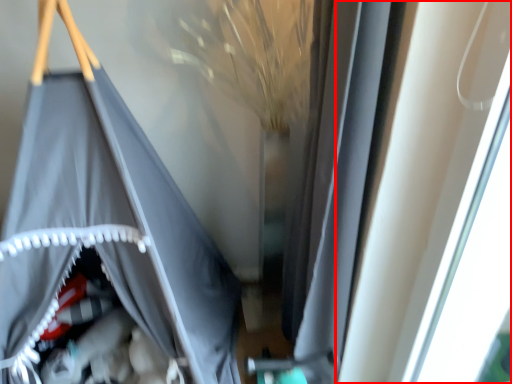
Question: From the image, what is the correct spatial relationship of window (annotated by the red box) in relation to curtain?

Choices:
 (A) left
 (B) right

Answer: (B)